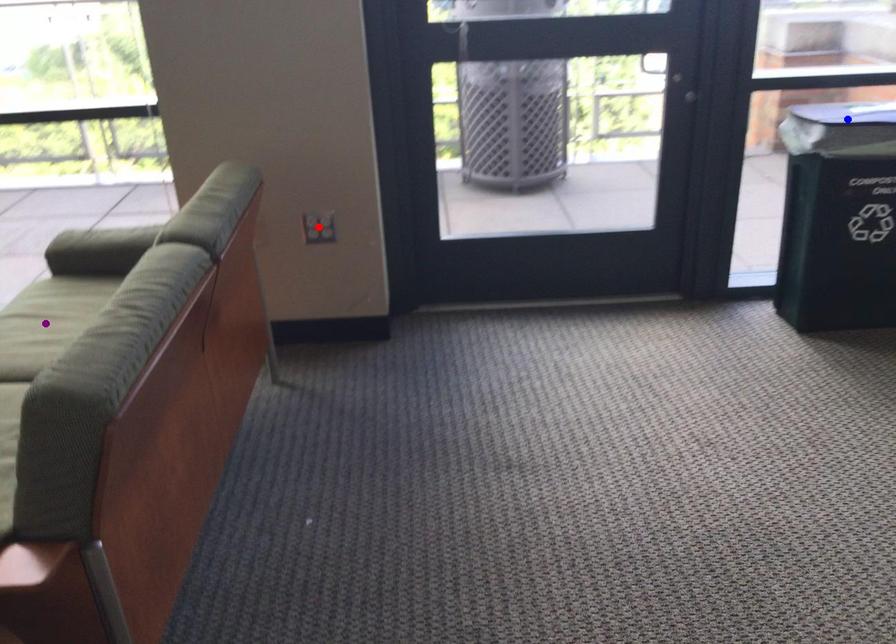
Order these from nearest to farthest:
1. blue point
2. red point
3. purple point

purple point → blue point → red point